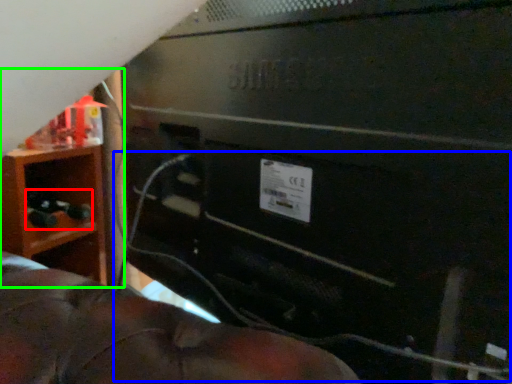
Question: Estimate the real-world distances between objects in this image. Which object is farther from toy (highlighted by a red box), wire (highlighted by a blue box) or furniture (highlighted by a green box)?

Choices:
 (A) wire
 (B) furniture

Answer: (A)